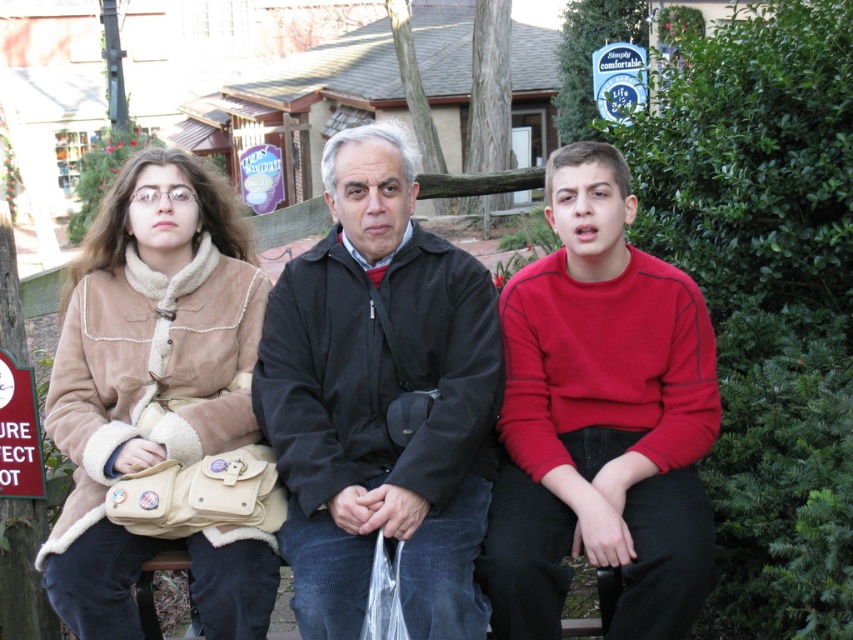
You are a photographer standing 2 meters away from the red matte sweater at center. You want to take a photo of the camera that is 3.02 meters away from the sweater. Is the camera within your camera lens range if your camera can focus up to 4 meters?

The camera is 3.02 meters away from the red matte sweater at center. Since your current distance to the sweater is 2 meters, the total distance from you to the camera would be 2 meters plus 3.02 meters, totaling 5.02 meters. Your camera can only focus up to 4 meters, so the camera is out of range.

You are a fashion designer observing the two individuals in the park. You need to determine which clothing item, the black matte jacket at center or the red matte sweater at center, would require more fabric to produce. Based on the description, which one would need more material?

The black matte jacket at center has a larger size compared to the red matte sweater at center, so it would require more fabric to produce.